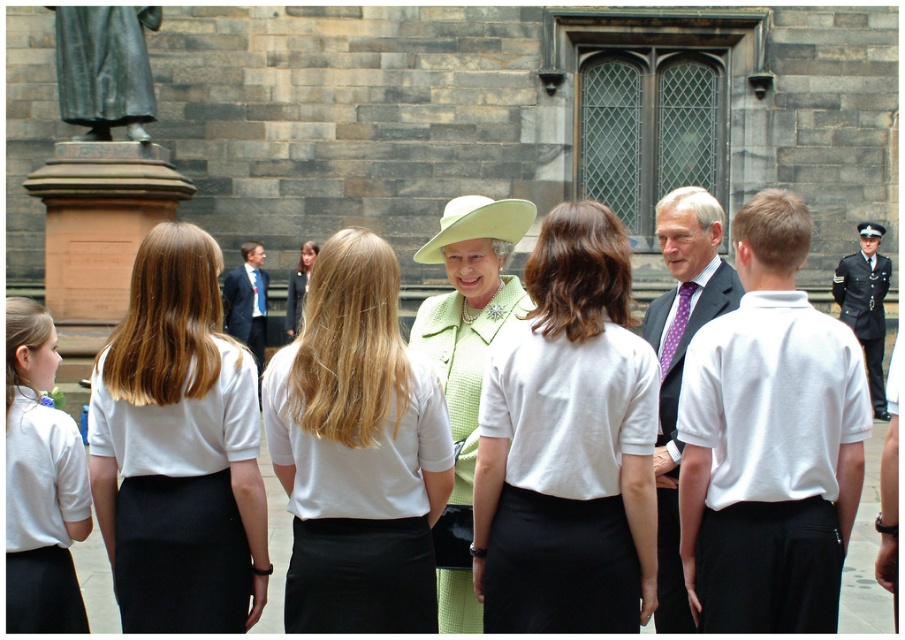
You are a photographer at this gathering and want to ensure both the dark blue uniform at right and the white fabric uniform at center are fully visible in your photo. Which uniform should you focus on to avoid cropping the edges?

You should focus on the white fabric uniform at center because it is taller than the dark blue uniform at right, so ensuring it fits in the frame will automatically include the shorter one.

You are standing in the historic stone building and looking out the large leaded glass window. You see a point at coordinates [246,301] outside. What object is located at that point?

The point at coordinates [246,301] indicates the matte blue suit at center.

In the scene shown: You are a photographer at the event and need to ensure both the lime green knitted coat at center and the white fabric uniform at center are visible in the photo. Based on their positions, which one is closer to the camera?

The lime green knitted coat at center is below the white fabric uniform at center, meaning it is closer to the camera since it appears lower in the image.